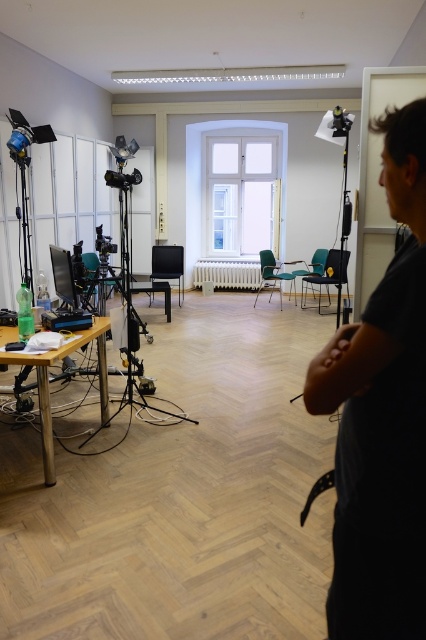
Question: Which of the following is the closest to the observer?

Choices:
 (A) (120, 268)
 (B) (403, 624)

Answer: (B)

Question: Is black matte shirt at right thinner than matte black tripod at center?

Choices:
 (A) no
 (B) yes

Answer: (B)

Question: Is black matte shirt at right to the right of matte black tripod at center from the viewer's perspective?

Choices:
 (A) no
 (B) yes

Answer: (B)

Question: Is black matte shirt at right below matte black tripod at center?

Choices:
 (A) yes
 (B) no

Answer: (A)

Question: Which point is closer to the camera?

Choices:
 (A) (397, 154)
 (B) (131, 403)

Answer: (A)